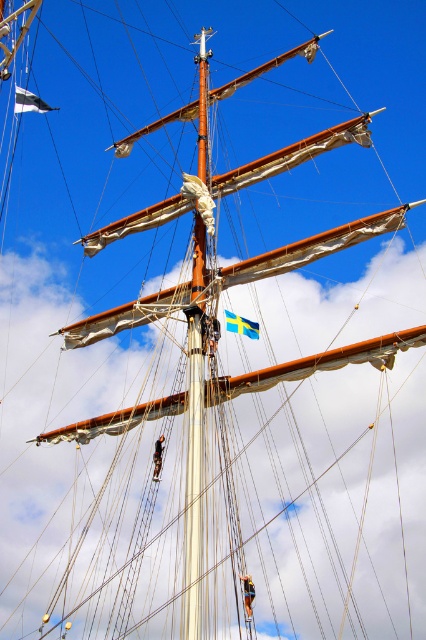
Is point (17, 97) closer to viewer compared to point (256, 333)?

No, it is behind (256, 333).

Who is higher up, white fabric flag at upper left or blue fabric flag at upper center?

white fabric flag at upper left

Where is `white fabric flag at upper left`? Image resolution: width=426 pixels, height=640 pixels. white fabric flag at upper left is located at coordinates (29, 100).

This screenshot has width=426, height=640. Identify the location of white fabric flag at upper left. (29, 100).